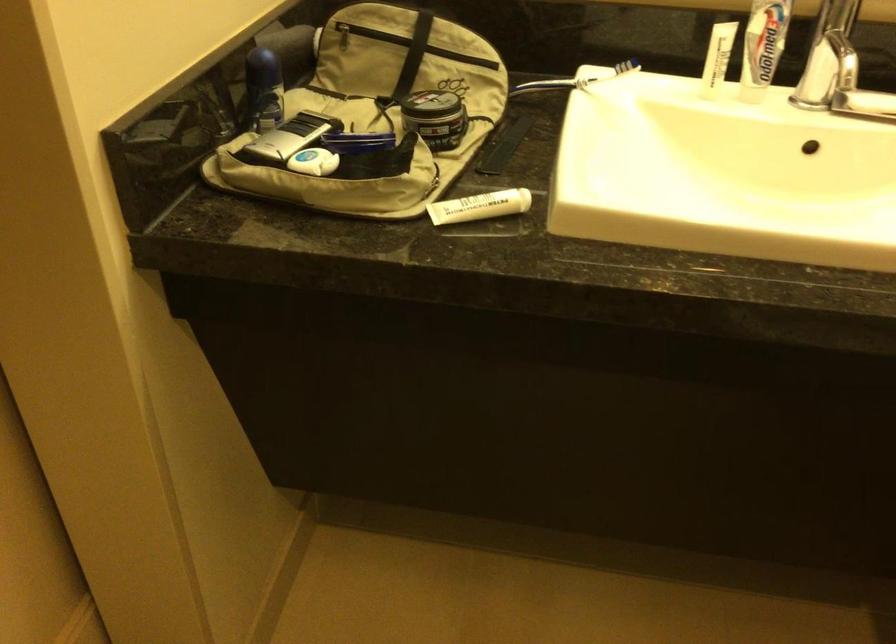
Which object does [288,137] point to?

It refers to a electric razor.